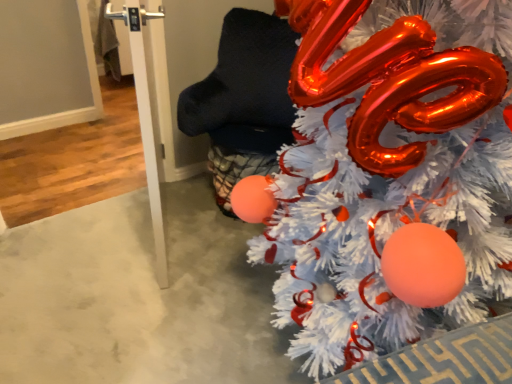
Image resolution: width=512 pixels, height=384 pixels. In order to click on vacant region to the left of white glossy door handle at left in this screenshot , I will do `click(82, 232)`.